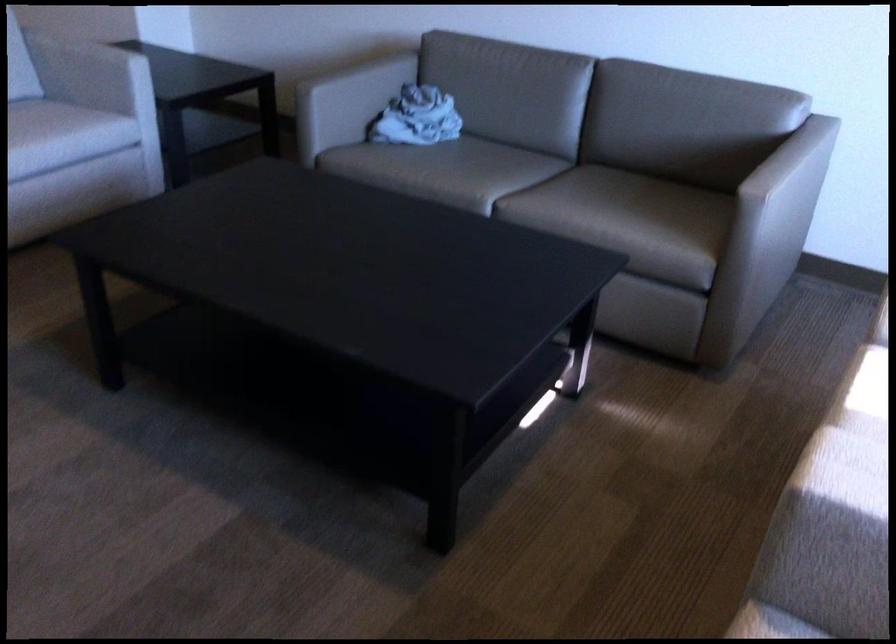
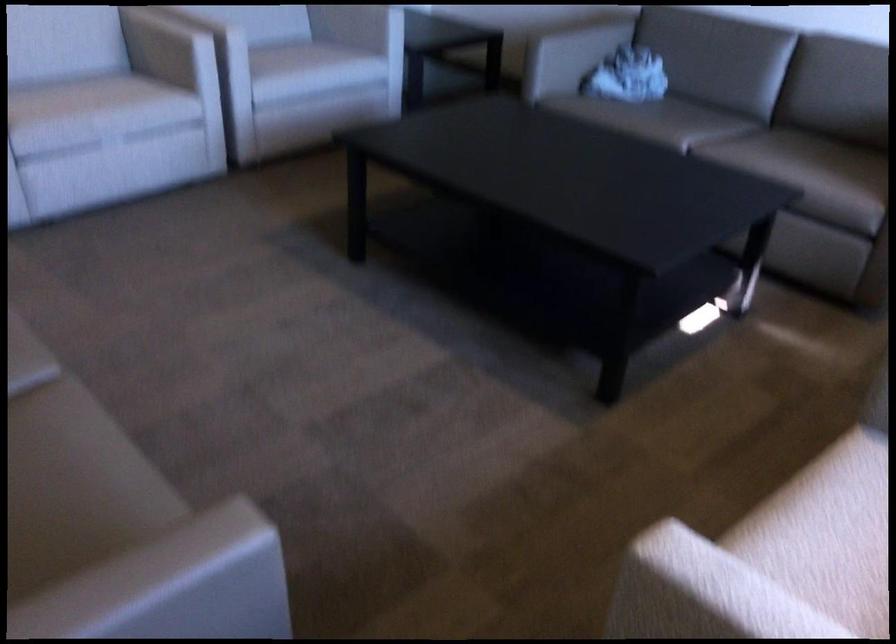
Locate, in the second image, the point that corresponds to point 521,174 in the first image.

(714, 127)